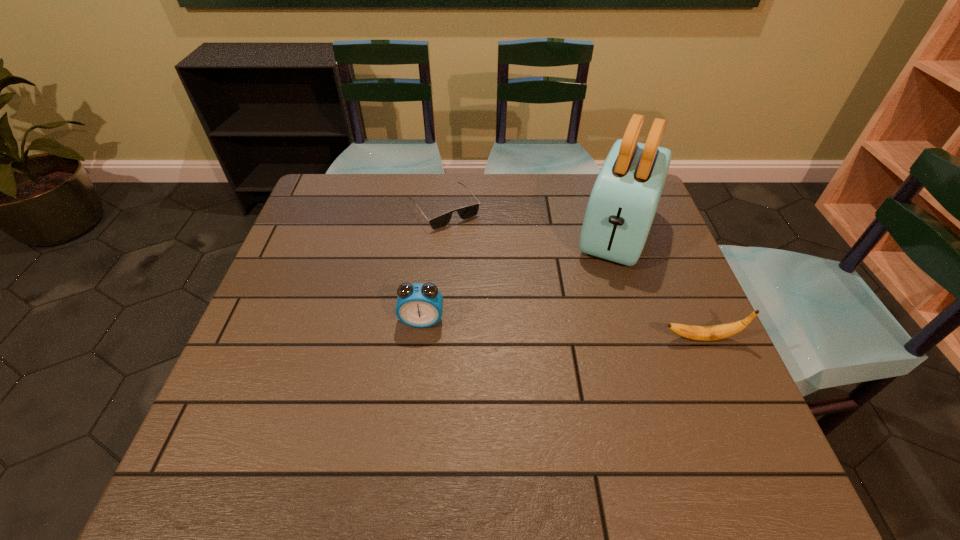
Image resolution: width=960 pixels, height=540 pixels. I want to click on free space on the desktop that is between the alarm clock and the second shortest object and is positioned on the front-facing side of the shortest object, so click(541, 328).

Find the location of `vacant space on the desktop that is between the third shortest object and the banana and is positioned on the side of the tallest object with the lever`. vacant space on the desktop that is between the third shortest object and the banana and is positioned on the side of the tallest object with the lever is located at coordinates (580, 330).